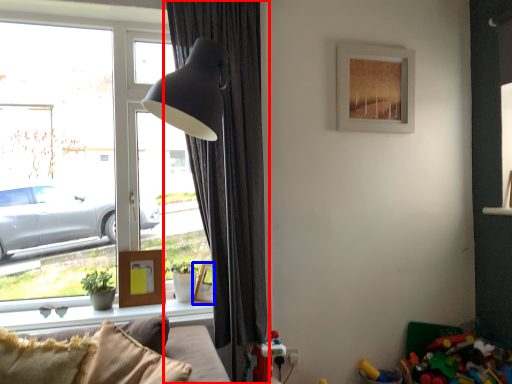
Question: Which point is closer to the camera, curtain (highlighted by a red box) or picture frame (highlighted by a blue box)?

Choices:
 (A) curtain
 (B) picture frame

Answer: (A)